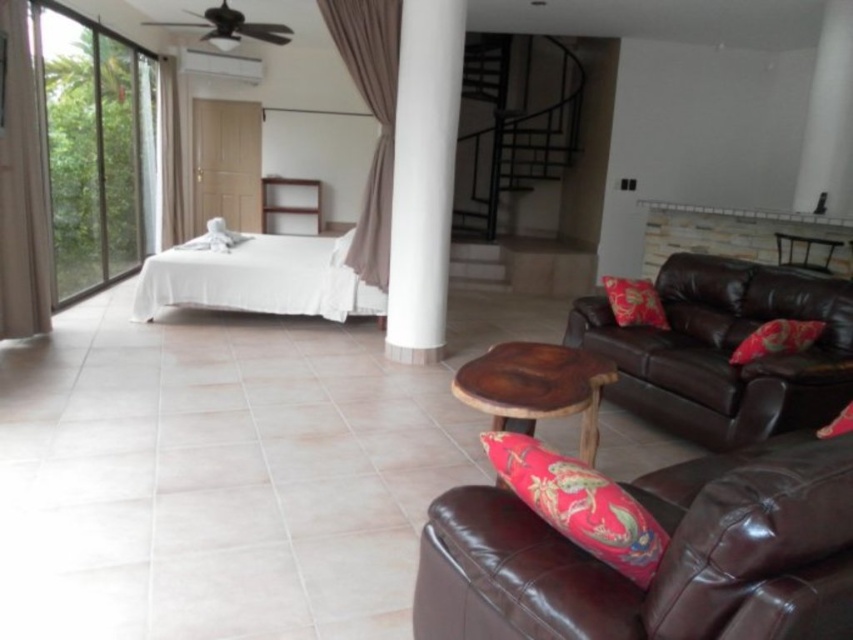
Question: Is white smooth column at center above white sheer curtain at left?

Choices:
 (A) yes
 (B) no

Answer: (B)

Question: Which object is farther from the camera taking this photo?

Choices:
 (A) white stone fireplace at upper right
 (B) beige fabric curtain at upper center
 (C) brown leather armchair at upper right

Answer: (C)

Question: Which point is closer to the camera?

Choices:
 (A) (152, 220)
 (B) (581, 364)
 (C) (621, 404)
 (D) (572, 568)

Answer: (D)

Question: Which object is farther from the camera taking this photo?

Choices:
 (A) beige fabric curtain at upper center
 (B) brown leather armchair at lower right

Answer: (A)

Question: Is brown leather couch at right smaller than beige fabric curtain at upper center?

Choices:
 (A) no
 (B) yes

Answer: (A)

Question: Does brown leather couch at right appear under brown leather armchair at upper right?

Choices:
 (A) no
 (B) yes

Answer: (B)